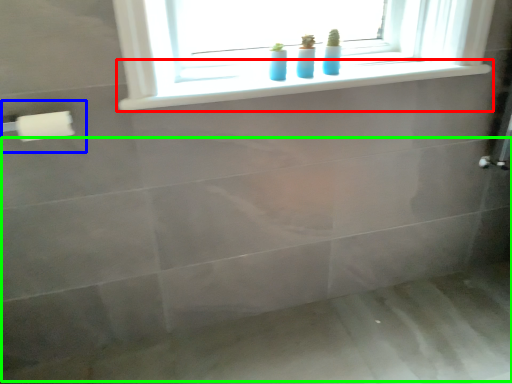
Question: Which object is positioned farthest from window sill (highlighted by a red box)? Select from towel bar (highlighted by a blue box) and bath (highlighted by a green box).

Choices:
 (A) towel bar
 (B) bath

Answer: (B)